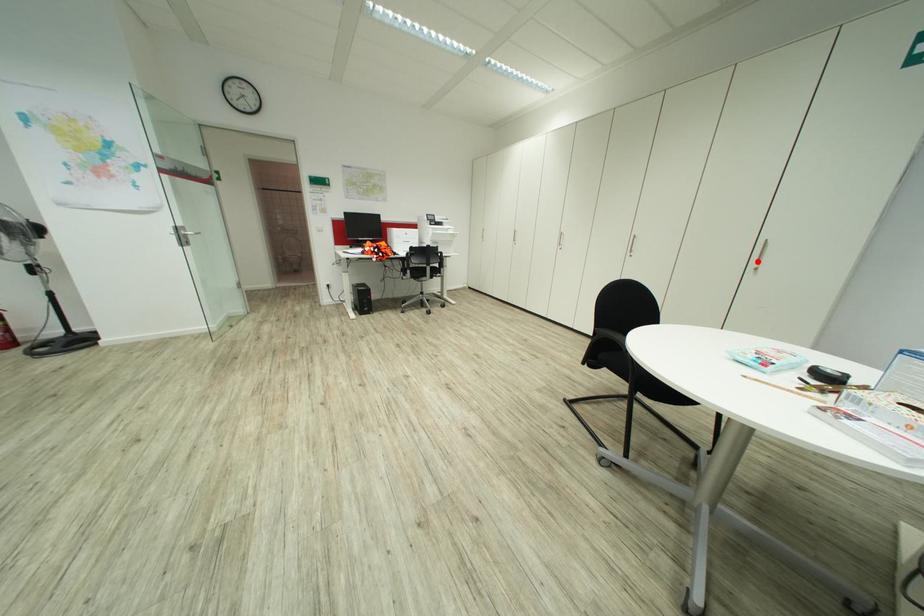
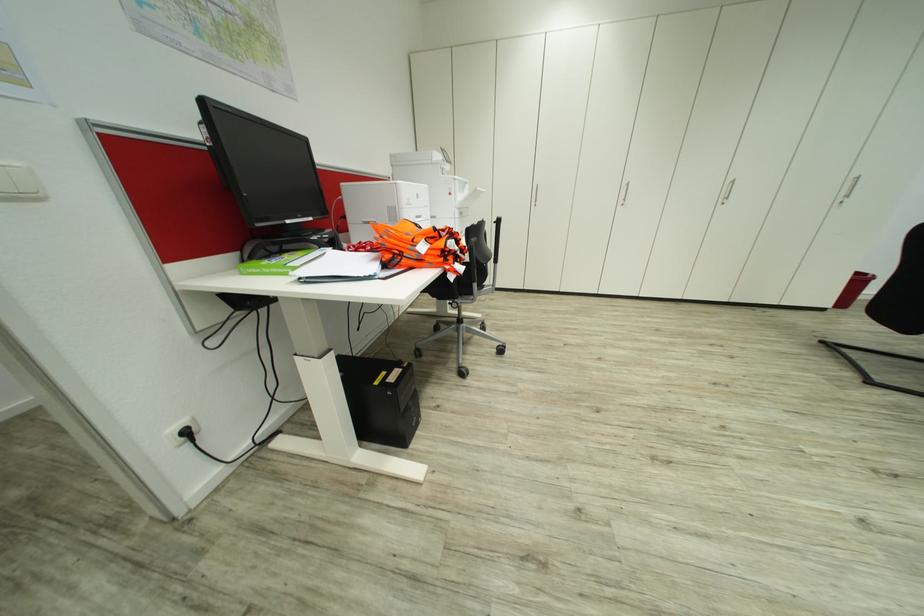
Question: I am providing you with two images of the same scene from different viewpoints. Given a red point in image1, look at the same physical point in image2. Is it:

Choices:
 (A) Closer to the viewpoint
 (B) Farther from the viewpoint

Answer: (B)